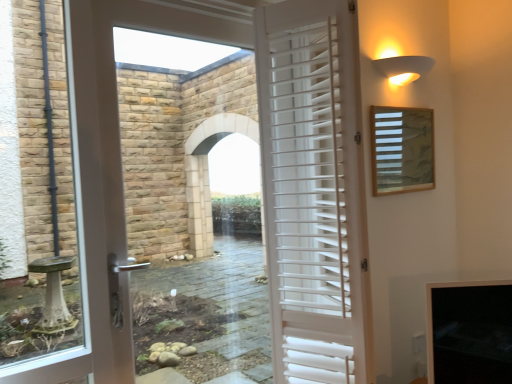
Looking at this image, what is the approximate width of wooden slats at upper right?

wooden slats at upper right is 1.89 inches in width.

Describe the element at coordinates (311, 189) in the screenshot. I see `white wooden shutters at center` at that location.

What is the approximate height of white matte wall sconce at upper right?

white matte wall sconce at upper right is 4.55 inches in height.

Describe the element at coordinates (403, 68) in the screenshot. Image resolution: width=512 pixels, height=384 pixels. I see `white matte wall sconce at upper right` at that location.

Locate an element on the screen. The image size is (512, 384). wooden slats at upper right is located at coordinates (402, 149).

Is white wooden shutters at center at the right side of wooden slats at upper right?

In fact, white wooden shutters at center is to the left of wooden slats at upper right.

Considering the relative sizes of white wooden shutters at center and wooden slats at upper right in the image provided, is white wooden shutters at center thinner than wooden slats at upper right?

No.

How different are the orientations of white wooden shutters at center and wooden slats at upper right in degrees?

white wooden shutters at center and wooden slats at upper right are facing 12 degrees away from each other.

From the image's perspective, does white wooden shutters at center appear lower than wooden slats at upper right?

Correct, white wooden shutters at center appears lower than wooden slats at upper right in the image.

Would you say wooden slats at upper right is outside white wooden shutters at center?

Indeed, wooden slats at upper right is completely outside white wooden shutters at center.

What's the angular difference between wooden slats at upper right and white wooden shutters at center's facing directions?

The angular difference between wooden slats at upper right and white wooden shutters at center is 12 degrees.

Considering the positions of objects wooden slats at upper right and white wooden shutters at center in the image provided, who is behind, wooden slats at upper right or white wooden shutters at center?

wooden slats at upper right is more distant.

From the picture: Between white matte wall sconce at upper right and white wooden shutters at center, which one appears on the right side from the viewer's perspective?

From the viewer's perspective, white matte wall sconce at upper right appears more on the right side.

Considering the sizes of objects white matte wall sconce at upper right and white wooden shutters at center in the image provided, who is shorter, white matte wall sconce at upper right or white wooden shutters at center?

With less height is white matte wall sconce at upper right.

Considering the points (408, 74) and (346, 112), which point is behind, point (408, 74) or point (346, 112)?

The point (408, 74) is behind.

Is white wooden shutters at center inside white matte wall sconce at upper right?

No, white wooden shutters at center is not inside white matte wall sconce at upper right.

What's the angular difference between white matte wall sconce at upper right and wooden slats at upper right's facing directions?

white matte wall sconce at upper right and wooden slats at upper right are facing 0.431 degrees away from each other.

Based on the photo, is white matte wall sconce at upper right smaller than wooden slats at upper right?

Indeed, white matte wall sconce at upper right has a smaller size compared to wooden slats at upper right.

Considering the positions of objects white matte wall sconce at upper right and wooden slats at upper right in the image provided, who is behind, white matte wall sconce at upper right or wooden slats at upper right?

wooden slats at upper right is more distant.

How much distance is there between white matte wall sconce at upper right and wooden slats at upper right?

white matte wall sconce at upper right and wooden slats at upper right are 11.91 inches apart.

Does point (386, 128) come in front of point (418, 68)?

Yes.

From a real-world perspective, between wooden slats at upper right and white matte wall sconce at upper right, who is vertically higher?

In real-world perspective, white matte wall sconce at upper right is above.

Is wooden slats at upper right closer to the viewer compared to white matte wall sconce at upper right?

No.

Is white matte wall sconce at upper right at the back of wooden slats at upper right?

No, wooden slats at upper right's orientation is not away from white matte wall sconce at upper right.

Considering their positions, is white wooden shutters at center located in front of or behind white matte wall sconce at upper right?

white wooden shutters at center is in front of white matte wall sconce at upper right.

From the image's perspective, which object appears higher, white wooden shutters at center or white matte wall sconce at upper right?

white matte wall sconce at upper right.

From a real-world perspective, between white wooden shutters at center and white matte wall sconce at upper right, who is vertically lower?

From a 3D spatial view, white wooden shutters at center is below.

What's the angular difference between white wooden shutters at center and white matte wall sconce at upper right's facing directions?

The angle between the facing direction of white wooden shutters at center and the facing direction of white matte wall sconce at upper right is 12.4 degrees.

I want to click on door below the wooden slats at upper right (from the image's perspective), so click(311, 189).

Where is `door in front of the wooden slats at upper right`? door in front of the wooden slats at upper right is located at coordinates coord(311,189).

Estimate the real-world distances between objects in this image. Which object is closer to white matte wall sconce at upper right, white wooden shutters at center or wooden slats at upper right?

Based on the image, wooden slats at upper right appears to be nearer to white matte wall sconce at upper right.

Estimate the real-world distances between objects in this image. Which object is closer to wooden slats at upper right, white matte wall sconce at upper right or white wooden shutters at center?

white matte wall sconce at upper right.

From the image, which object appears to be farther from white matte wall sconce at upper right, wooden slats at upper right or white wooden shutters at center?

white wooden shutters at center lies further to white matte wall sconce at upper right than the other object.

Looking at the image, which one is located further to white wooden shutters at center, wooden slats at upper right or white matte wall sconce at upper right?

Among the two, white matte wall sconce at upper right is located further to white wooden shutters at center.

Looking at the image, which one is located further to white wooden shutters at center, white matte wall sconce at upper right or wooden slats at upper right?

white matte wall sconce at upper right lies further to white wooden shutters at center than the other object.

Looking at the image, which one is located closer to wooden slats at upper right, white wooden shutters at center or white matte wall sconce at upper right?

Based on the image, white matte wall sconce at upper right appears to be nearer to wooden slats at upper right.

Where is `window screen between white matte wall sconce at upper right and white wooden shutters at center from top to bottom`? The height and width of the screenshot is (384, 512). window screen between white matte wall sconce at upper right and white wooden shutters at center from top to bottom is located at coordinates (402, 149).